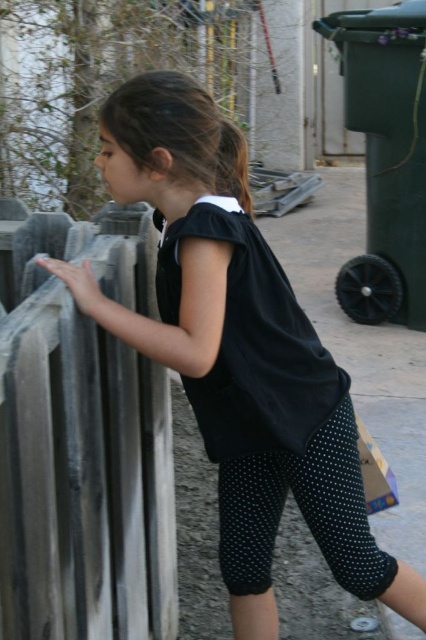
Does rusty metal fence at left appear on the right side of black matte dress at center?

Incorrect, rusty metal fence at left is not on the right side of black matte dress at center.

Can you confirm if rusty metal fence at left is taller than black matte dress at center?

Yes.

Which is behind, point (161, 508) or point (267, 378)?

Positioned behind is point (161, 508).

Locate an element on the screen. This screenshot has height=640, width=426. rusty metal fence at left is located at coordinates (83, 442).